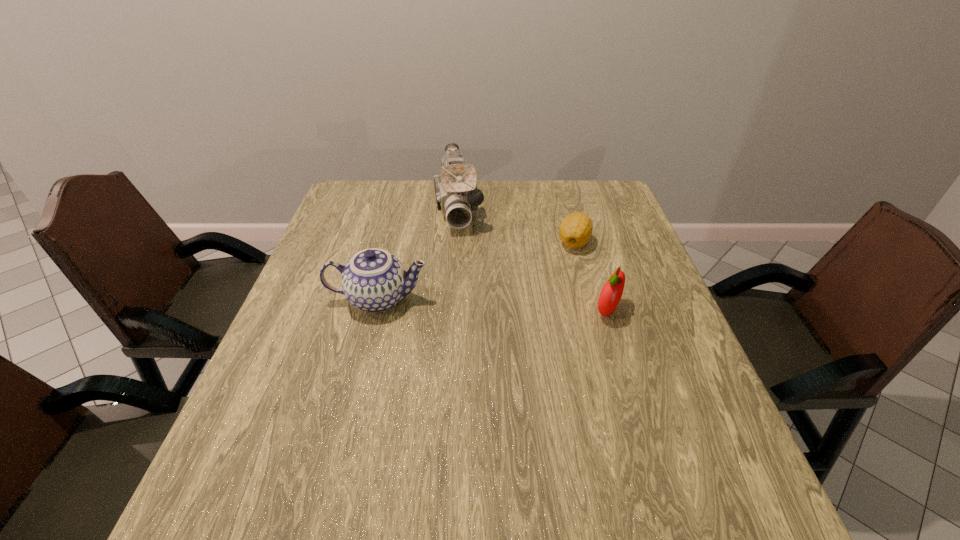
At what (x,y) coordinates should I click in order to perform the action: click on vacant region between the lemon and the camcorder. Please return your answer as a coordinate pair (x, y). This screenshot has height=540, width=960. Looking at the image, I should click on (516, 225).

Where is `free space between the tallest object and the lemon`? This screenshot has height=540, width=960. free space between the tallest object and the lemon is located at coordinates (516, 225).

The width and height of the screenshot is (960, 540). Find the location of `free area in between the lemon and the third tallest object`. free area in between the lemon and the third tallest object is located at coordinates (590, 276).

Where is `object that is the second closest to the chinaware`? object that is the second closest to the chinaware is located at coordinates (575, 230).

Locate an element on the screen. The image size is (960, 540). object identified as the second closest to the camcorder is located at coordinates (575, 230).

I want to click on vacant area in the image that satisfies the following two spatial constraints: 1. on the front side of the apple; 2. on the right side of the tallest object, so click(450, 310).

Where is `free space that satisfies the following two spatial constraints: 1. on the front side of the apple; 2. on the right side of the shortest object`? This screenshot has width=960, height=540. free space that satisfies the following two spatial constraints: 1. on the front side of the apple; 2. on the right side of the shortest object is located at coordinates (592, 310).